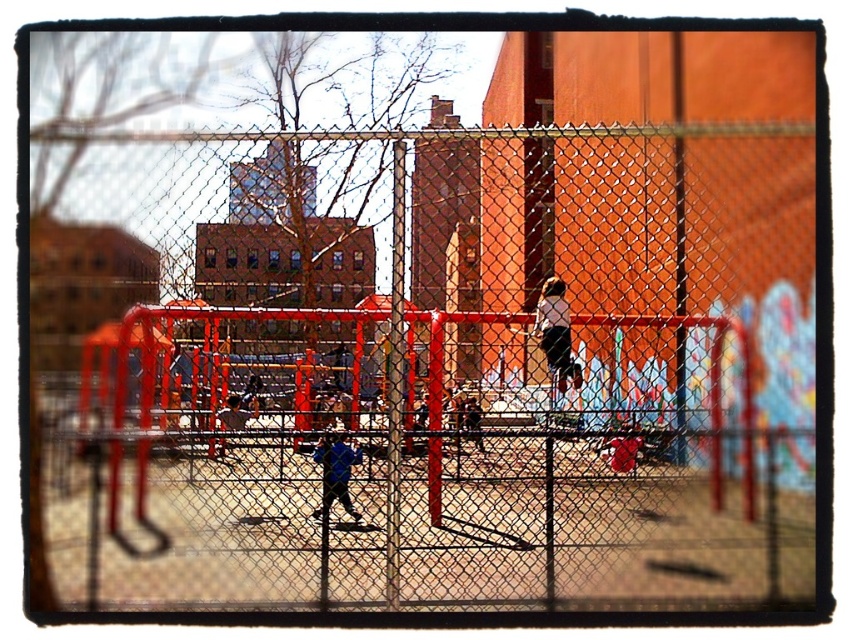
Looking at this image, you are a photographer who wants to capture a clear shot of the playground equipment through the metal mesh fence at center and the white matte shirt at upper center. Since the fence is in the way, can you adjust your camera angle to focus on the playground equipment without the fence blocking the view?

The metal mesh fence at center is wider than the white matte shirt at upper center, so adjusting the camera angle to focus on the playground equipment while avoiding the metal mesh fence at center might be challenging due to its larger width. However, focusing on the white matte shirt at upper center area could allow a clearer view without the fence obstruction.

You are standing at the playground and looking through the chainlink fence. You see two points marked on the image, point (664, 321) and point (347, 456). Which point is closer to you?

Point (664, 321) is further to the camera than point (347, 456), so point (347, 456) is closer to you.